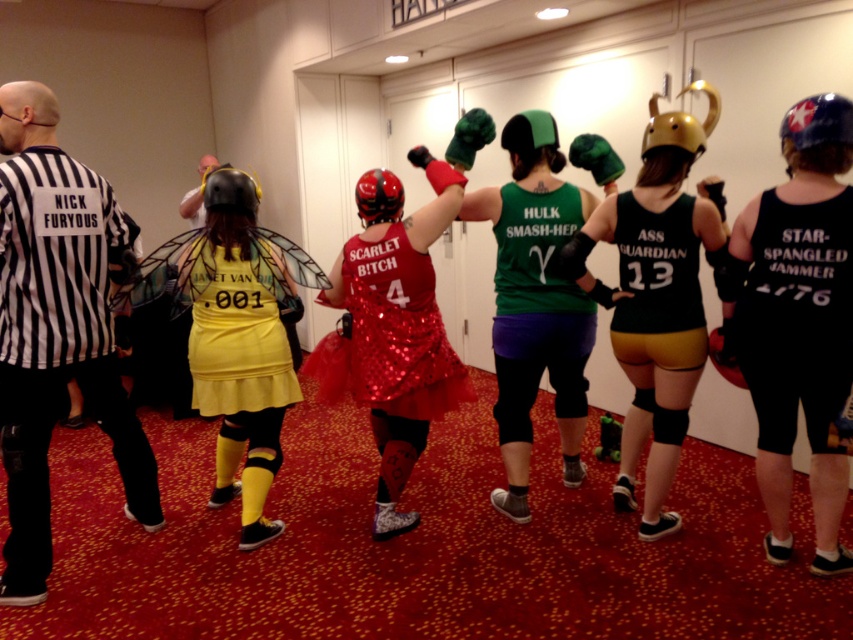
You are standing at the center of the convention center and see two points marked in the scene. The first point is at coordinates point (x=548, y=220) and the second is at point (x=704, y=131). Which point is closer to you?

Point (x=548, y=220) is closer to you because it is further to the camera than point (x=704, y=131).